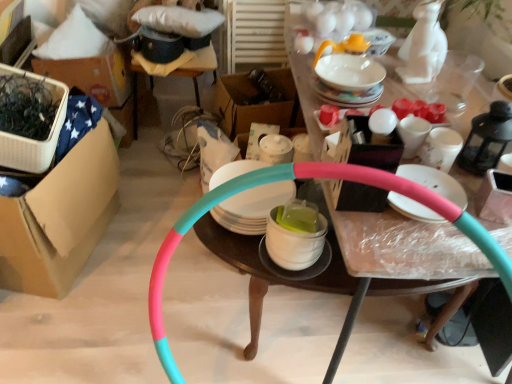
This screenshot has width=512, height=384. I want to click on free spot in front of matte white plate at center, arranged as the sixth tableware when viewed from the top, so click(x=425, y=251).